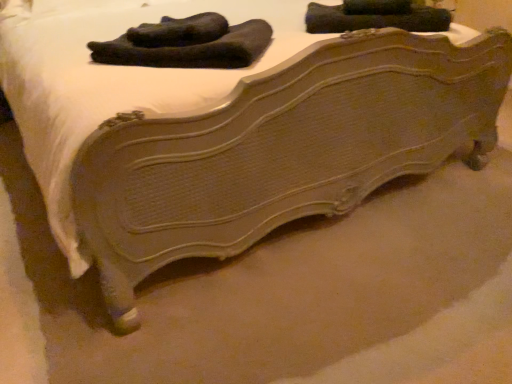
Question: Considering the positions of black fuzzy socks at upper center and velvet-like black socks at upper center in the image, is black fuzzy socks at upper center taller or shorter than velvet-like black socks at upper center?

Choices:
 (A) tall
 (B) short

Answer: (B)

Question: In terms of size, does black fuzzy socks at upper center appear bigger or smaller than velvet-like black socks at upper center?

Choices:
 (A) big
 (B) small

Answer: (B)

Question: From the image's perspective, is black fuzzy socks at upper center located above or below velvet-like black socks at upper center?

Choices:
 (A) above
 (B) below

Answer: (B)

Question: Is velvet-like black socks at upper center inside the boundaries of black fuzzy socks at upper center, or outside?

Choices:
 (A) inside
 (B) outside

Answer: (B)

Question: Considering the positions of point (438, 26) and point (240, 59), is point (438, 26) closer or farther from the camera than point (240, 59)?

Choices:
 (A) farther
 (B) closer

Answer: (A)

Question: In terms of width, does velvet-like black socks at upper center look wider or thinner when compared to black fuzzy socks at upper center?

Choices:
 (A) wide
 (B) thin

Answer: (B)

Question: Relative to black fuzzy socks at upper center, is velvet-like black socks at upper center in front or behind?

Choices:
 (A) behind
 (B) front

Answer: (A)